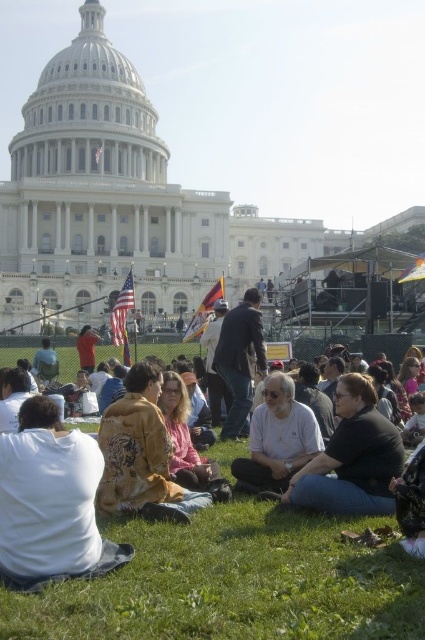
Does gold textured jacket at center have a larger size compared to dark gray fabric jacket at center?

Yes, gold textured jacket at center is bigger than dark gray fabric jacket at center.

Is gold textured jacket at center closer to camera compared to dark gray fabric jacket at center?

That is True.

Find the location of `gold textured jacket at center`. gold textured jacket at center is located at coordinates (141, 452).

Locate an element on the screen. The width and height of the screenshot is (425, 640). gold textured jacket at center is located at coordinates (141, 452).

Looking at this image, is green grass at lower center bigger than white cotton shirt at center?

Yes.

Does point (345, 547) come closer to viewer compared to point (282, 428)?

Yes.

Locate an element on the screen. The image size is (425, 640). green grass at lower center is located at coordinates (235, 582).

What are the coordinates of `green grass at lower center` in the screenshot? It's located at (235, 582).

Does dark gray fabric jacket at center appear under white cotton shirt at center?

No.

Which is more to the left, dark gray fabric jacket at center or white cotton shirt at center?

Positioned to the left is white cotton shirt at center.

Measure the distance between point (391,426) and camera.

Point (391,426) and camera are 53.03 meters apart.

Image resolution: width=425 pixels, height=640 pixels. Find the location of `dark gray fabric jacket at center`. dark gray fabric jacket at center is located at coordinates (351, 458).